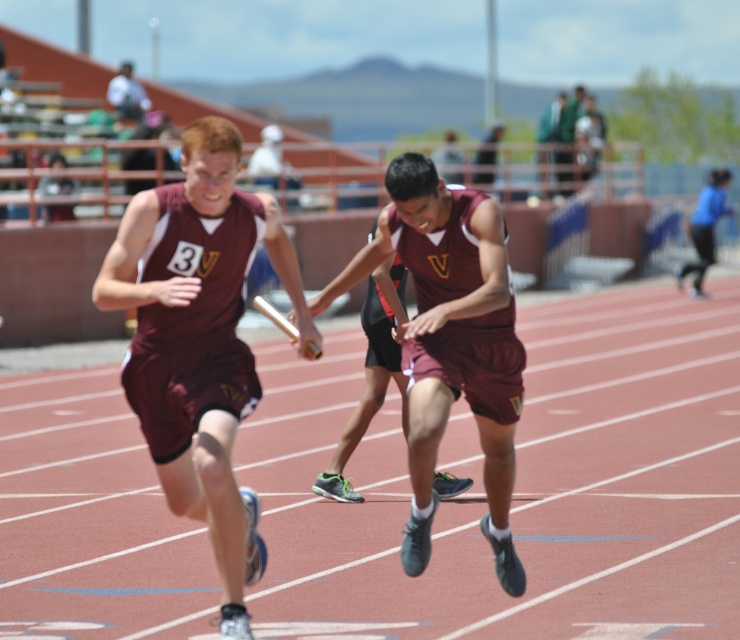
Which is more to the right, maroon jersey at center or maroon fabric uniform at center?

Positioned to the right is maroon fabric uniform at center.

Does maroon jersey at center have a lesser width compared to maroon fabric uniform at center?

Yes, maroon jersey at center is thinner than maroon fabric uniform at center.

Who is more distant from viewer, (127, 392) or (420, 504)?

The point (420, 504) is behind.

The width and height of the screenshot is (740, 640). Find the location of `maroon jersey at center`. maroon jersey at center is located at coordinates (198, 339).

Between maroon fabric uniform at center and blue fabric runner at right, which one is positioned lower?

Positioned lower is maroon fabric uniform at center.

Is maroon fabric uniform at center smaller than blue fabric runner at right?

Correct, maroon fabric uniform at center occupies less space than blue fabric runner at right.

Does point (517, 372) come in front of point (699, 288)?

Yes, it is.

The width and height of the screenshot is (740, 640). In order to click on maroon fabric uniform at center in this screenshot , I will do `click(451, 342)`.

Is maroon jersey at center to the right of blue fabric runner at right from the viewer's perspective?

Incorrect, maroon jersey at center is not on the right side of blue fabric runner at right.

Looking at this image, can you confirm if maroon jersey at center is shorter than blue fabric runner at right?

Yes, maroon jersey at center is shorter than blue fabric runner at right.

Is point (206, 404) positioned before point (707, 216)?

Yes, point (206, 404) is in front of point (707, 216).

Locate an element on the screen. maroon jersey at center is located at coordinates (198, 339).